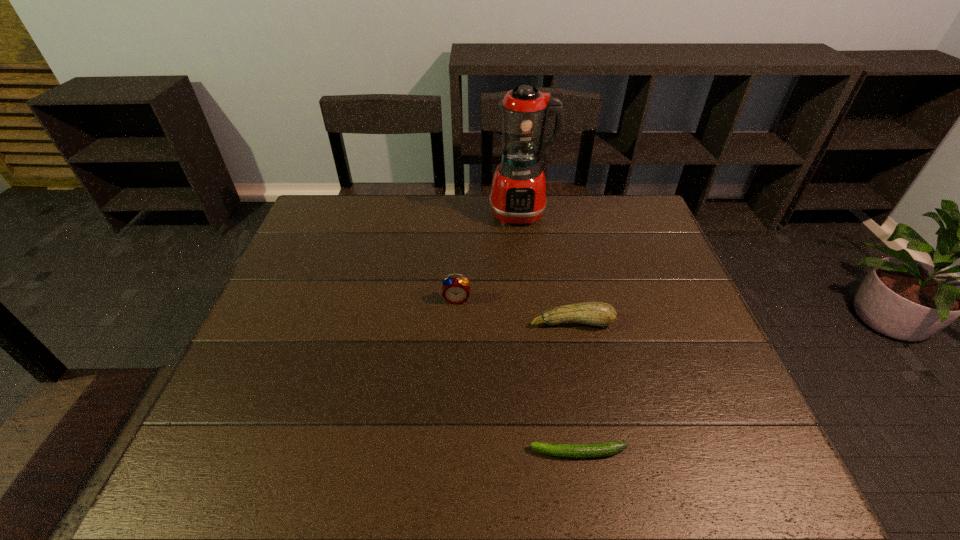
Find the location of a particular element. free space at the near left corner of the desktop is located at coordinates (276, 451).

In order to click on free space at the near right corner of the desktop in this screenshot , I will do `click(752, 477)`.

The image size is (960, 540). Find the location of `vacant area that lies between the farther zucchini and the farthest object`. vacant area that lies between the farther zucchini and the farthest object is located at coordinates click(x=546, y=268).

Identify the location of unoccupied area between the farthest object and the leftmost object. (489, 256).

Where is `free point between the tallest object and the nearer zucchini`? The image size is (960, 540). free point between the tallest object and the nearer zucchini is located at coordinates (549, 333).

Find the location of a particular element. Image resolution: width=960 pixels, height=540 pixels. vacant area that lies between the tallest object and the alarm clock is located at coordinates (489, 256).

Where is `free spot between the farther zucchini and the farthest object`? This screenshot has height=540, width=960. free spot between the farther zucchini and the farthest object is located at coordinates (546, 268).

The image size is (960, 540). What are the coordinates of `free space between the second nearest object and the farthest object` in the screenshot? It's located at (546, 268).

In order to click on blank region between the shortest object and the leftmost object in this screenshot , I will do `click(517, 376)`.

What are the coordinates of `free spot between the taller zucchini and the second tallest object` in the screenshot? It's located at (515, 310).